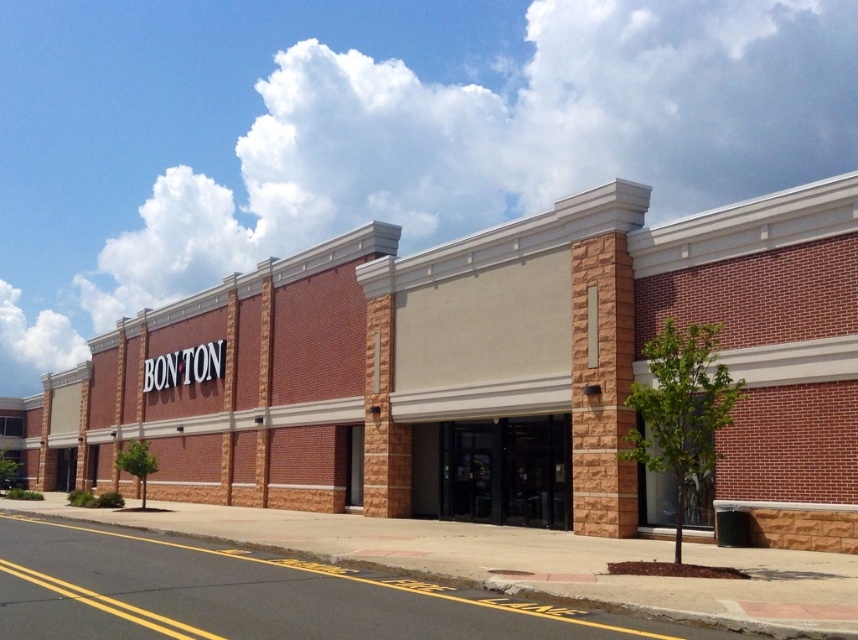
You are standing at the entrance of BONTON and want to walk to the point marked as point (427,436). Which direction should you move relative to point (663,288)?

You should move towards the direction of point (427,436), which is behind point (663,288) since point (663,288) is in front of it.

You are standing on the sidewalk in front of the brick building at center. If you walk directly towards the building, will you first reach the entrance or the tree?

The entrance is part of the brick building at center, so you would first reach the entrance before the tree.

You are a delivery person approaching the BONTON building. You need to drop off a package at the entrance. The brick building at center has a loading dock on its upper part. Are the black glass doors at center accessible from the ground level?

The brick building at center is located above the black glass doors at center, so the black glass doors at center are accessible from the ground level since they are positioned below the brick building at center.